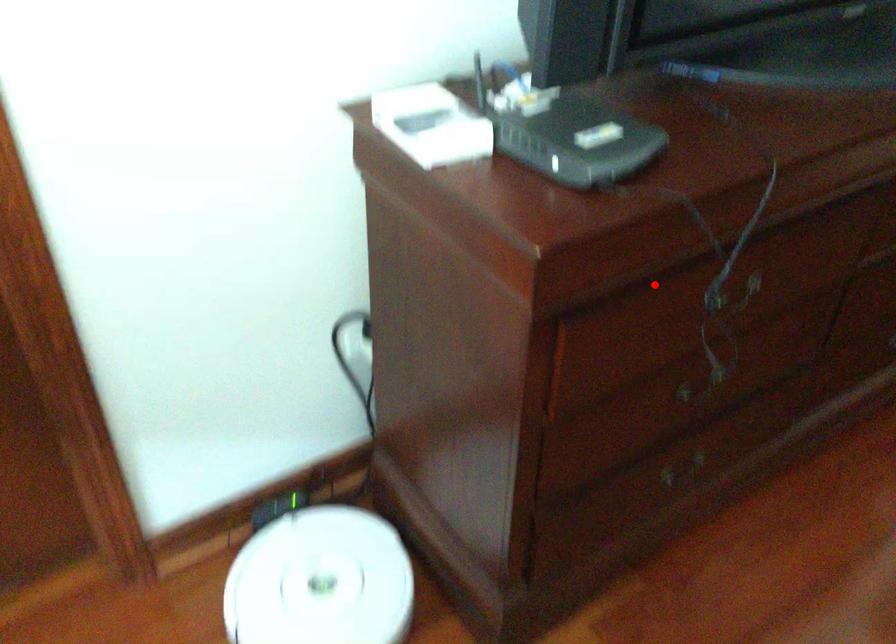
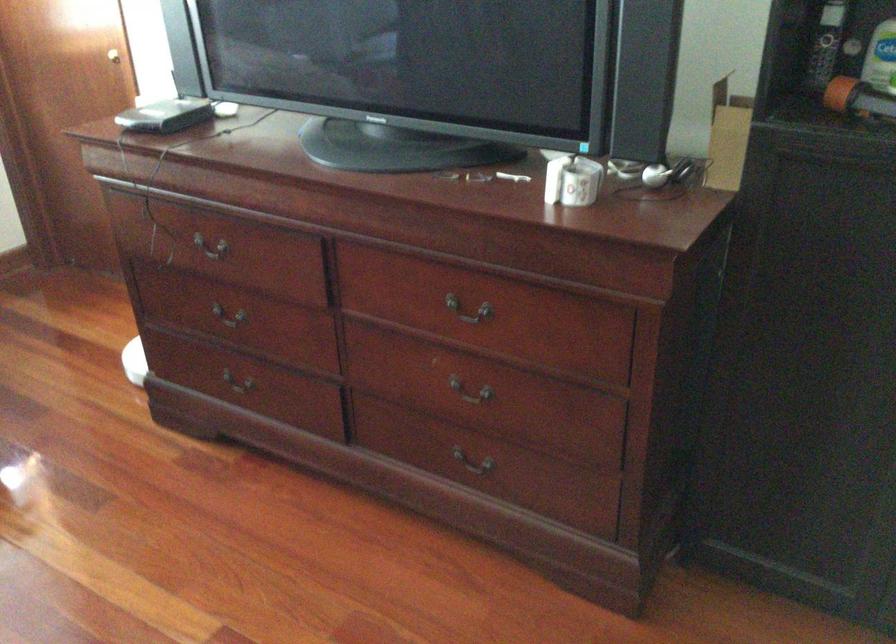
Question: I am providing you with two images of the same scene from different viewpoints. In image1, a red point is highlighted. Considering the same 3D point in image2, which of the following is correct?

Choices:
 (A) It is closer
 (B) It is farther

Answer: (B)